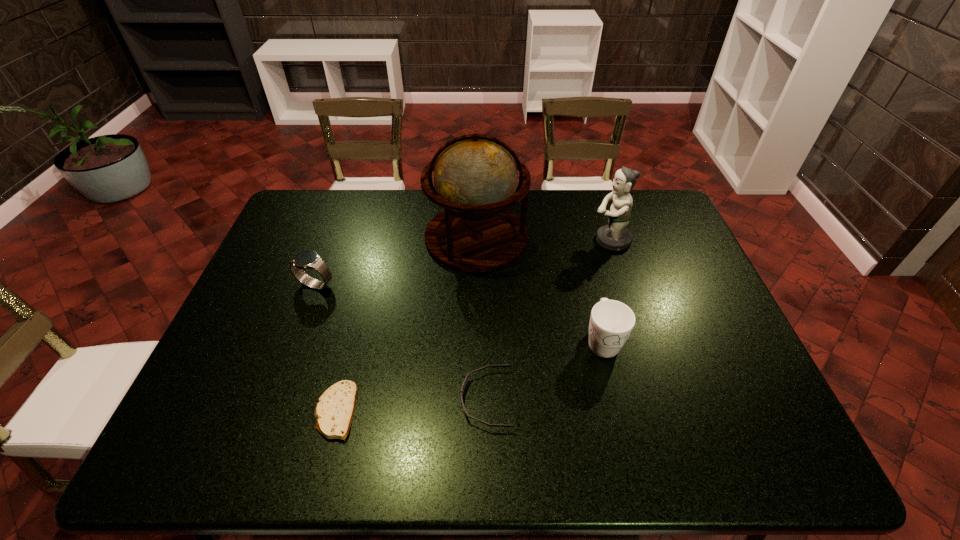
The image size is (960, 540). I want to click on free point between the globe and the figurine, so click(x=543, y=239).

You are a GUI agent. You are given a task and a screenshot of the screen. Output one action in this format:
    pyautogui.click(x=<x>, y=<y>)
    Task: Click on the unoccupied area between the globe and the pita bread
    
    Given the screenshot: What is the action you would take?
    [x=406, y=325]

Find the location of a particular element. The height and width of the screenshot is (540, 960). vacant area that lies between the leftmost object and the pita bread is located at coordinates (325, 348).

Identify the location of free area in between the fourth farthest object and the globe. (540, 289).

In order to click on empty space that is in between the second shortest object and the fifth shortest object in this screenshot , I will do `click(548, 320)`.

Where is `free space between the fifth tallest object and the fourth nearest object`? The image size is (960, 540). free space between the fifth tallest object and the fourth nearest object is located at coordinates (400, 342).

Find the location of a particular element. The width and height of the screenshot is (960, 540). free space between the sunglasses and the mug is located at coordinates (544, 370).

Identify the location of empty space between the third nearest object and the second tallest object. (607, 291).

Image resolution: width=960 pixels, height=540 pixels. What are the coordinates of `blank region between the sunglasses and the third farthest object` in the screenshot? It's located at (400, 342).

Identify which object is the fifth closest to the mug. Please provide its 2D coordinates. Your answer should be formatted as a tuple, i.e. [(x, y)], where the tuple contains the x and y coordinates of a point satisfying the conditions above.

[(308, 259)]